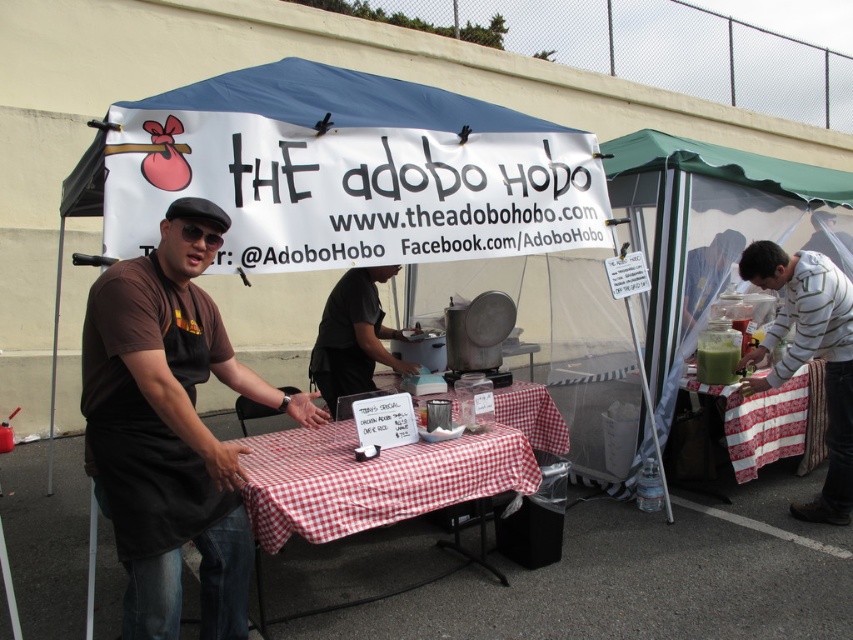
Question: Among these objects, which one is farthest from the camera?

Choices:
 (A) red checkered tablecloth at center
 (B) white striped sweater at right
 (C) green plastic pitcher at right

Answer: (C)

Question: Which object appears closest to the camera in this image?

Choices:
 (A) red checkered tablecloth at center
 (B) green plastic pitcher at right

Answer: (A)

Question: From the image, what is the correct spatial relationship of green plastic pitcher at right in relation to black matte shirt at center?

Choices:
 (A) right
 (B) left

Answer: (A)

Question: Which point appears closest to the camera in this image?

Choices:
 (A) (813, 376)
 (B) (341, 356)
 (C) (515, 454)
 (D) (126, 589)

Answer: (D)

Question: Does white striped sweater at right appear on the left side of green plastic pitcher at right?

Choices:
 (A) yes
 (B) no

Answer: (A)

Question: Can you confirm if brown matte apron at center is positioned above white striped sweater at right?

Choices:
 (A) yes
 (B) no

Answer: (B)